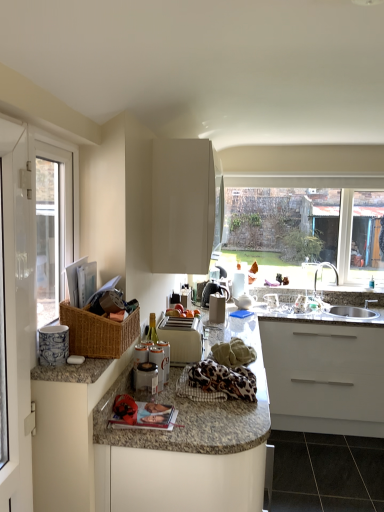
Locate an element on the screen. free point above granite at lower right (from a real-world perspective) is located at coordinates (337, 466).